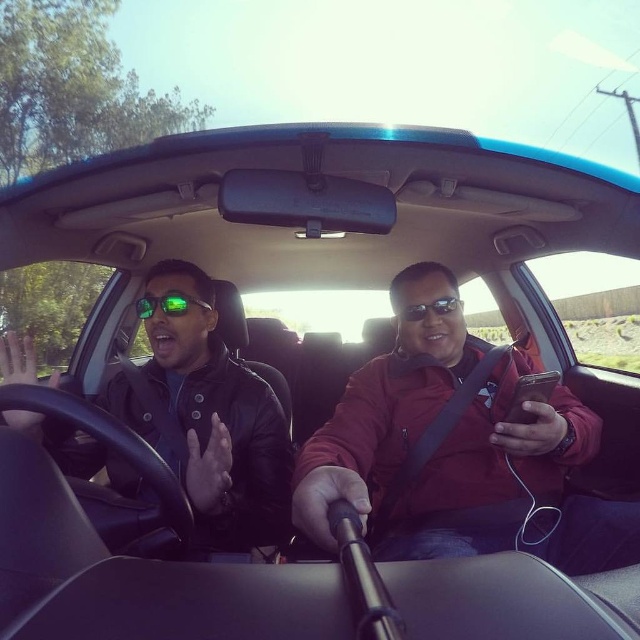
Which is in front, point (440, 273) or point (186, 444)?

Point (186, 444)

Does matte red jacket at center appear on the right side of leather jacket at left?

Correct, you'll find matte red jacket at center to the right of leather jacket at left.

Who is more forward, (371, 499) or (220, 385)?

Point (220, 385) is more forward.

Identify the location of matte red jacket at center. (438, 438).

Between point (228, 545) and point (156, 307), which one is positioned behind?

The point (156, 307) is more distant.

At what (x,y) coordinates should I click in order to perform the action: click on leather jacket at left. Please return your answer as a coordinate pair (x, y). This screenshot has width=640, height=640. Looking at the image, I should click on (208, 419).

Identify the location of leather jacket at left. (208, 419).

Is matte red jacket at center to the left of matte black sunglasses at center from the viewer's perspective?

Yes, matte red jacket at center is to the left of matte black sunglasses at center.

Is matte red jacket at center behind matte black sunglasses at center?

That is False.

Is point (506, 348) behind point (448, 308)?

That is True.

Identify the location of matte red jacket at center. (438, 438).